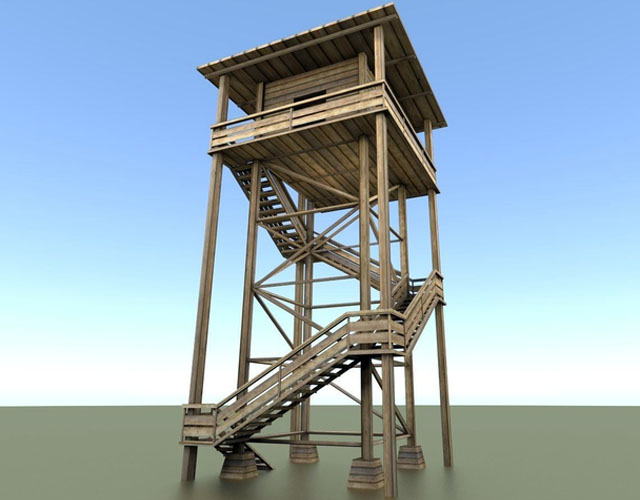
The image size is (640, 500). Find the location of `vertical beams`. vertical beams is located at coordinates (207, 318), (244, 318), (292, 299), (312, 293), (384, 277), (362, 284), (408, 259), (434, 248).